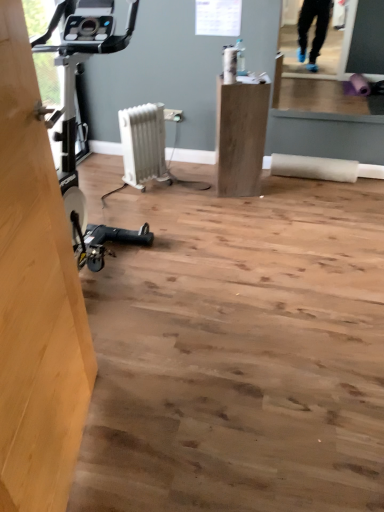
I want to click on vacant space to the right of light brown wood at left, so click(177, 437).